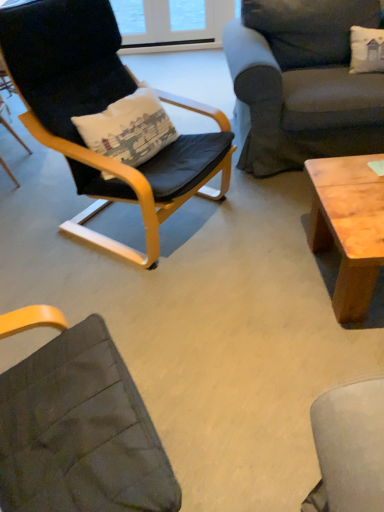
This screenshot has width=384, height=512. I want to click on free space in front of matte black chair at left, placed as the second chair when sorted from right to left, so click(24, 202).